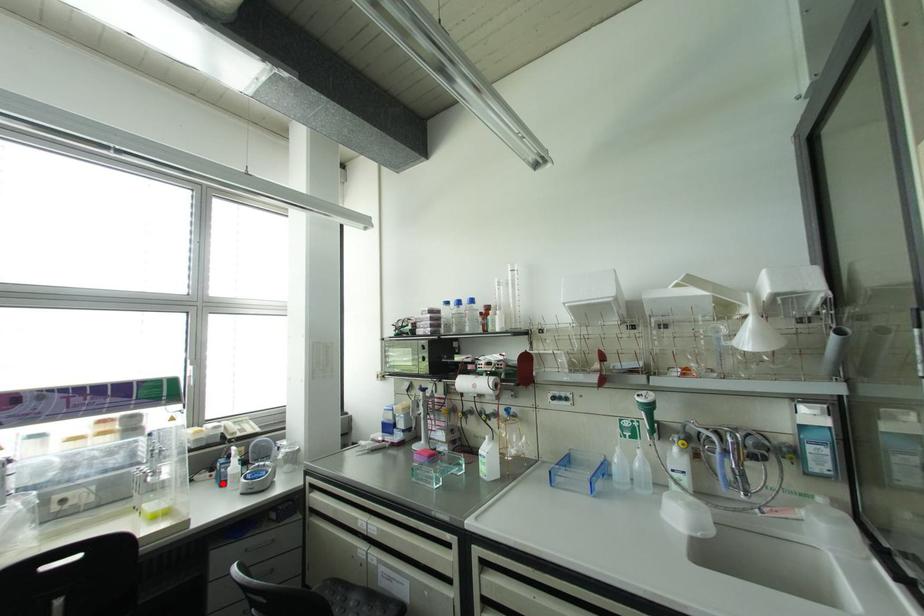
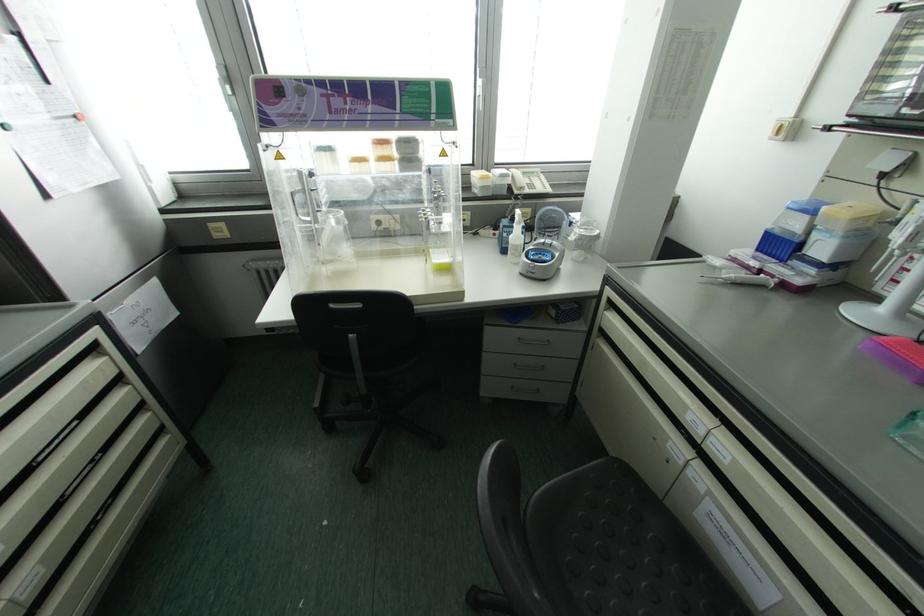
Question: I am providing you with two images of the same scene from different viewpoints. A red point is marked on the first image. At the location where the point appears in image 1, is it still visible in image 2?

Choices:
 (A) Yes
 (B) No

Answer: (A)